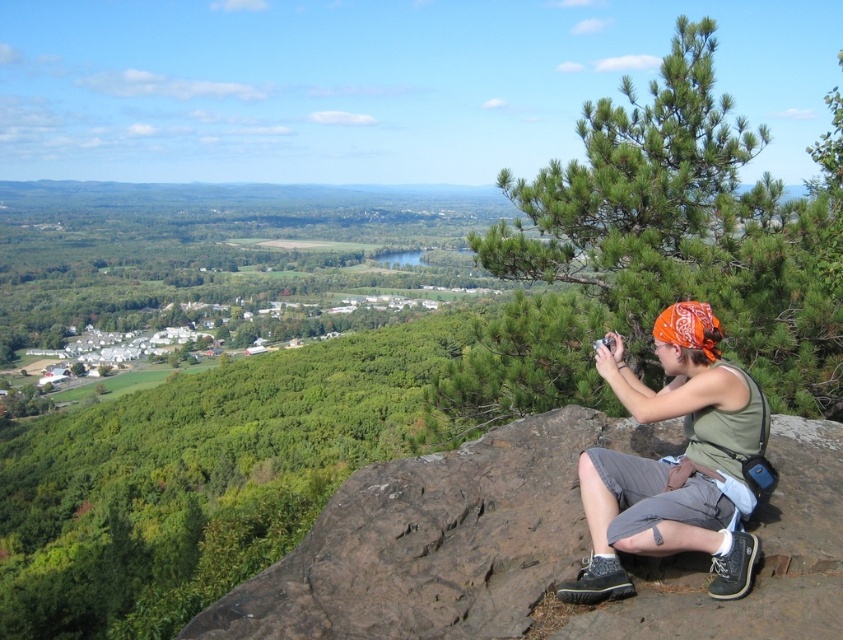
You are a photographer planning to capture a landscape shot from this overlook. Considering the brown rough rock at center and the green fabric tank top at center, which object would you use as a reference point for framing your composition?

The brown rough rock at center would be the better reference point because it has a larger size compared to the green fabric tank top at center, making it more prominent and stable in the frame.

You are standing at the overlook and want to take a photo of the valley below. The person in the image is sitting on the brown rough rock at center and wearing the green fabric tank top at center. Which object is closer to the edge of the rock where you can place your camera tripod?

The brown rough rock at center is to the left of the green fabric tank top at center, so the rock is closer to the edge. Place the tripod there.